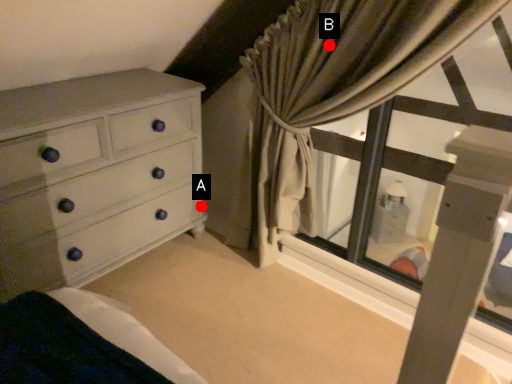
Question: Two points are circled on the image, labeled by A and B beside each circle. Which point is farther to the camera?

Choices:
 (A) A is further
 (B) B is further

Answer: (A)